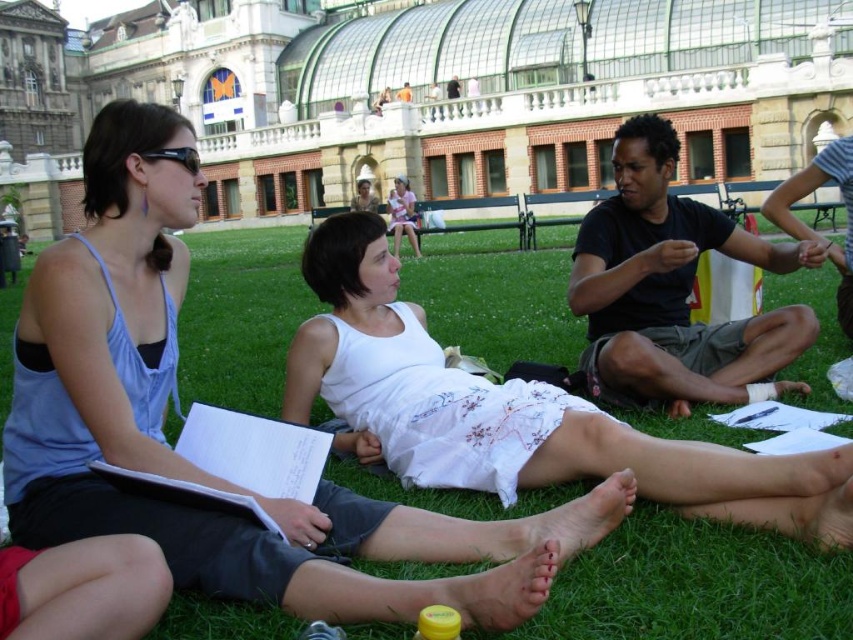
Question: Is white cotton dress at center thinner than black matte shirt at center?

Choices:
 (A) yes
 (B) no

Answer: (B)

Question: Which point is closer to the camera?

Choices:
 (A) (103, 250)
 (B) (393, 394)
 (C) (840, 138)
 (D) (756, 358)

Answer: (A)

Question: Which object is the closest to the dark brown leather jacket at right?

Choices:
 (A) black matte shirt at center
 (B) white cotton dress at center
 (C) smooth skin foot at lower center

Answer: (A)

Question: Does white cotton dress at center come in front of dark brown leather jacket at right?

Choices:
 (A) yes
 (B) no

Answer: (A)

Question: Which point is farther to the camera?

Choices:
 (A) black matte shirt at center
 (B) white cotton dress at center
 (C) smooth skin foot at lower center
 (D) matte blue tank top at left

Answer: (A)

Question: Does white cotton dress at center appear over smooth yellow foot at lower center?

Choices:
 (A) yes
 (B) no

Answer: (A)